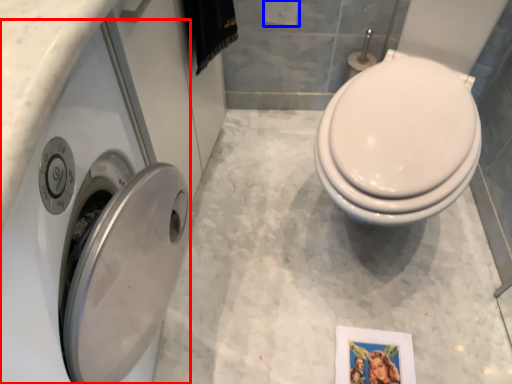
Question: Which object appears farthest to the camera in this image, washer (highlighted by a red box) or toilet paper (highlighted by a blue box)?

Choices:
 (A) washer
 (B) toilet paper

Answer: (B)